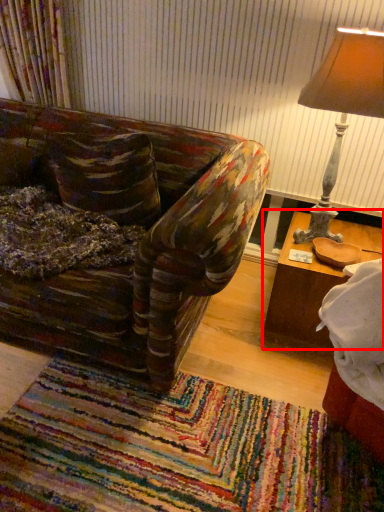
Question: Where is table (annotated by the red box) located in relation to lamp in the image?

Choices:
 (A) right
 (B) left

Answer: (A)